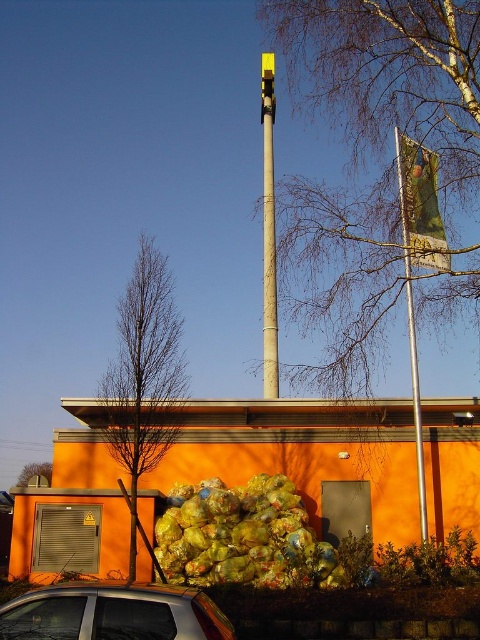
Question: Is bare branches at upper center bigger than bare branches at left?

Choices:
 (A) no
 (B) yes

Answer: (B)

Question: Estimate the real-world distances between objects in this image. Which object is farther from the green leafy tree at lower left?

Choices:
 (A) silver metallic flag pole at right
 (B) yellow matte traffic light at center

Answer: (A)

Question: Which of the following is the closest to the observer?

Choices:
 (A) [x=271, y=74]
 (B) [x=24, y=483]
 (C) [x=93, y=605]

Answer: (C)

Question: Is smooth metallic pole at center thinner than yellow matte traffic light at center?

Choices:
 (A) no
 (B) yes

Answer: (B)

Question: Which object appears closest to the camera in this image?

Choices:
 (A) green leafy tree at lower left
 (B) yellow matte traffic light at center
 (C) bare branches at upper center
 (D) smooth metallic pole at center

Answer: (C)

Question: Considering the relative positions of bare branches at upper center and bare branches at left in the image provided, where is bare branches at upper center located with respect to bare branches at left?

Choices:
 (A) left
 (B) right

Answer: (B)